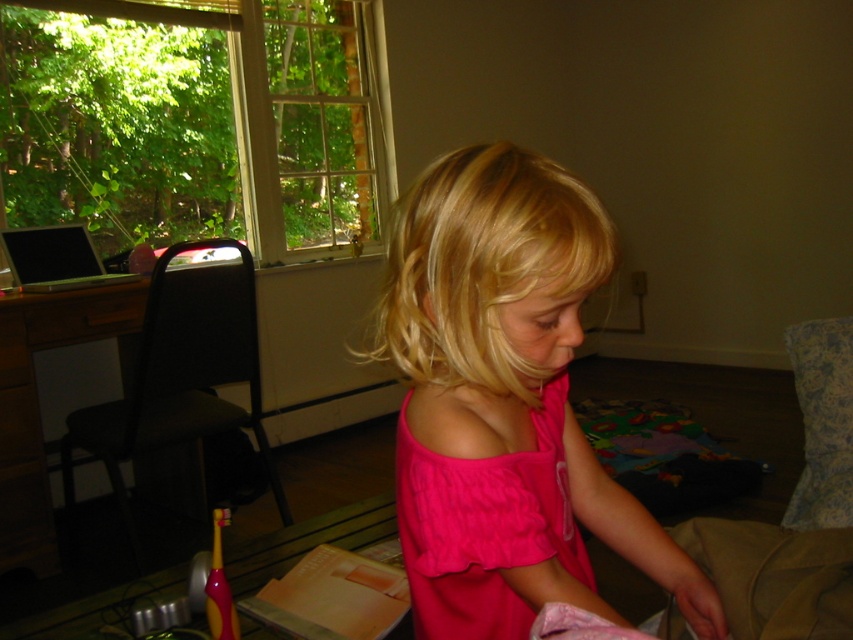
Question: Can you confirm if pink cotton shirt at center is positioned above cotton pink dress at center?

Choices:
 (A) yes
 (B) no

Answer: (A)

Question: Among these objects, which one is nearest to the camera?

Choices:
 (A) pink cotton shirt at center
 (B) cotton pink dress at center

Answer: (A)

Question: Considering the relative positions of pink cotton shirt at center and cotton pink dress at center in the image provided, where is pink cotton shirt at center located with respect to cotton pink dress at center?

Choices:
 (A) above
 (B) below

Answer: (A)

Question: Which point appears closest to the camera in this image?

Choices:
 (A) (573, 243)
 (B) (431, 589)

Answer: (A)

Question: Can you confirm if pink cotton shirt at center is smaller than cotton pink dress at center?

Choices:
 (A) no
 (B) yes

Answer: (A)